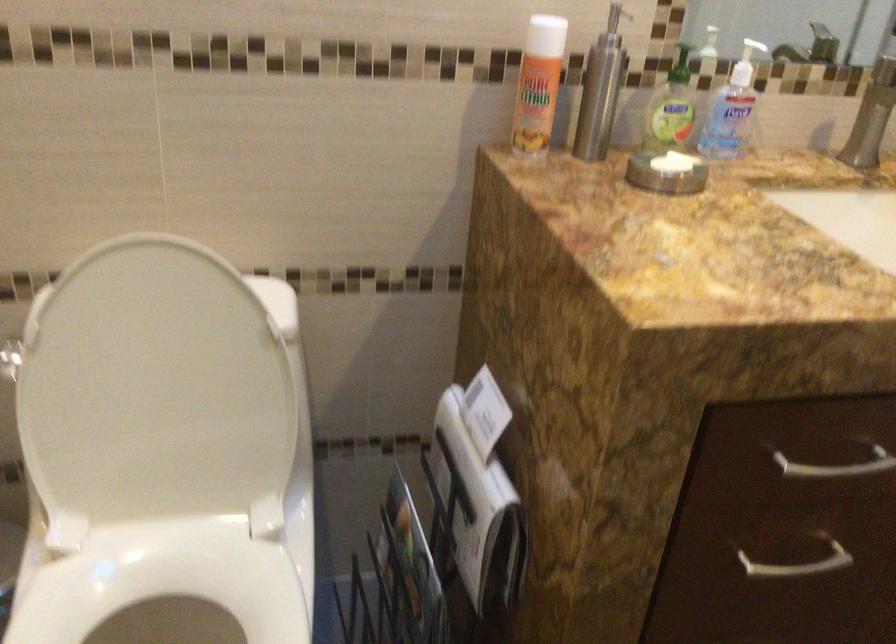
Where would you lift the white soap bar? Please return your answer as a coordinate pair (x, y).

(667, 172)